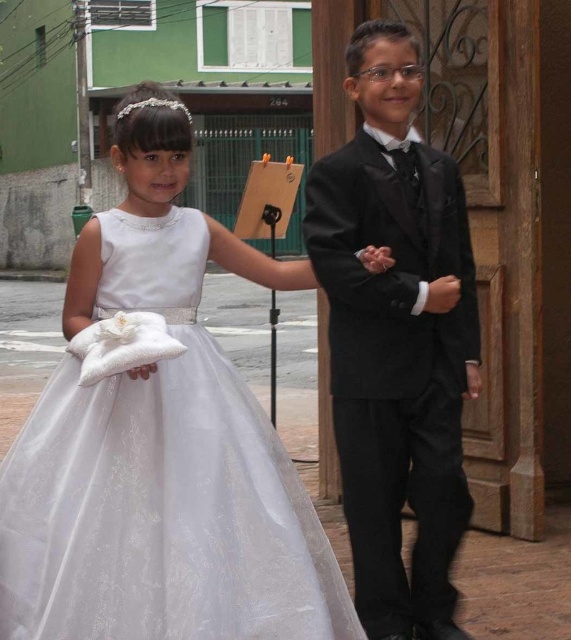
Question: Is white satin dress at center further to the viewer compared to black satin suit at center?

Choices:
 (A) yes
 (B) no

Answer: (B)

Question: Which object appears farthest from the camera in this image?

Choices:
 (A) white satin dress at center
 (B) black satin suit at center

Answer: (B)

Question: Which point is closer to the camera?

Choices:
 (A) (381, 371)
 (B) (69, 444)

Answer: (B)

Question: Is white satin dress at center positioned at the back of black satin suit at center?

Choices:
 (A) yes
 (B) no

Answer: (B)

Question: Which point appears closest to the camera in this image?

Choices:
 (A) (93, 540)
 (B) (343, 353)

Answer: (A)

Question: Can you confirm if white satin dress at center is positioned below black satin suit at center?

Choices:
 (A) no
 (B) yes

Answer: (B)